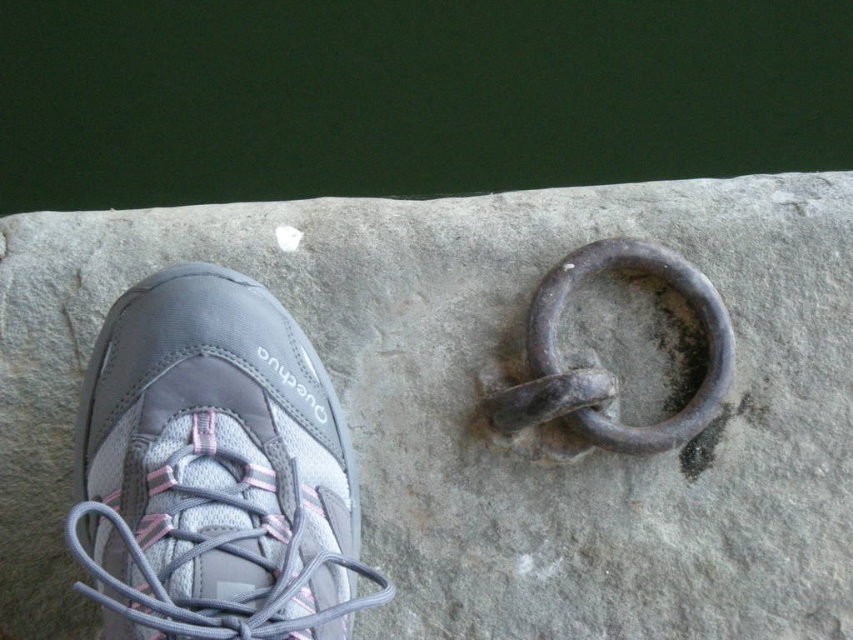
You are a hiker trying to secure your gear. You have two rings available, the gray stone ring at center and the rusty metal ring at center. According to the image, which ring is positioned lower?

The gray stone ring at center is positioned below the rusty metal ring at center, so it is lower.